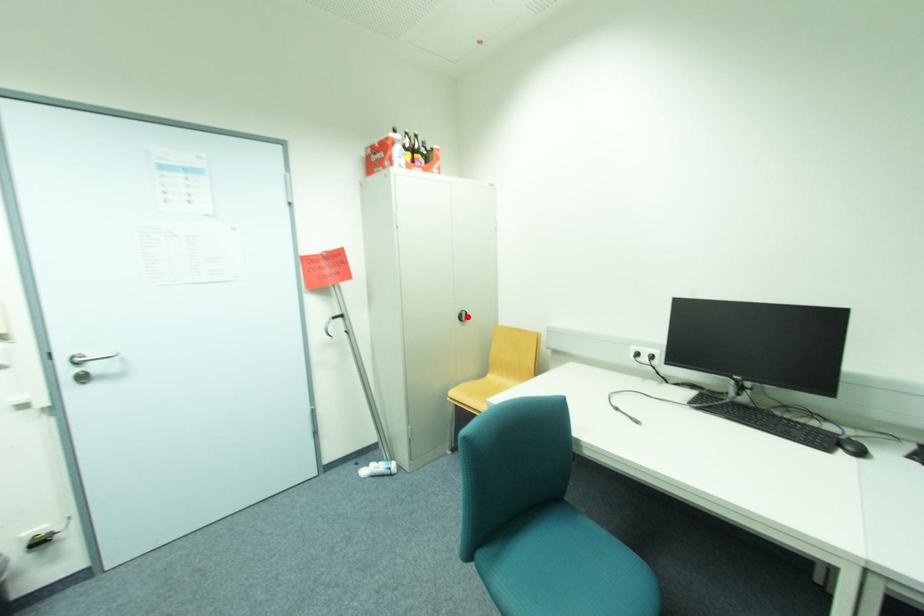
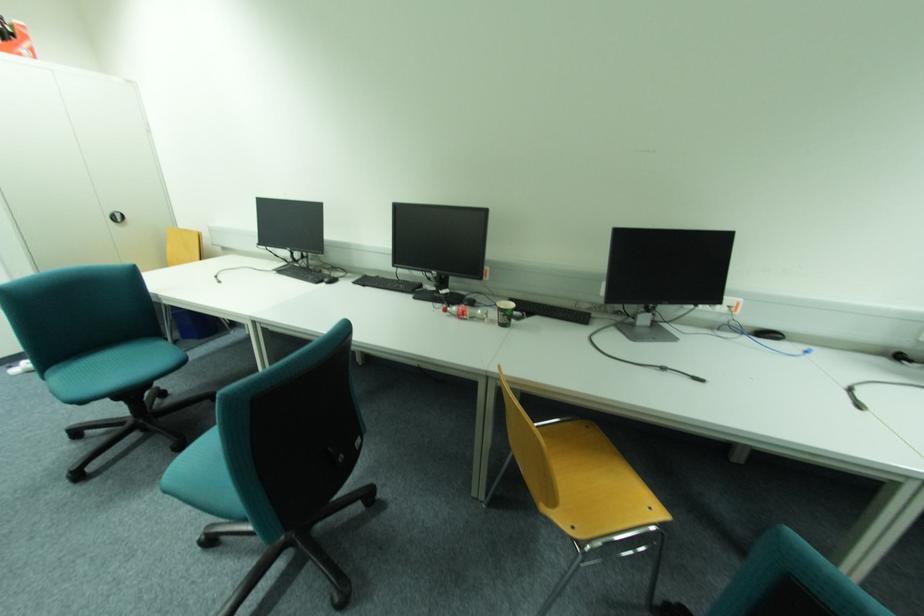
Find the pixel in the second image that matches the highlighted location in the first image.

(126, 219)